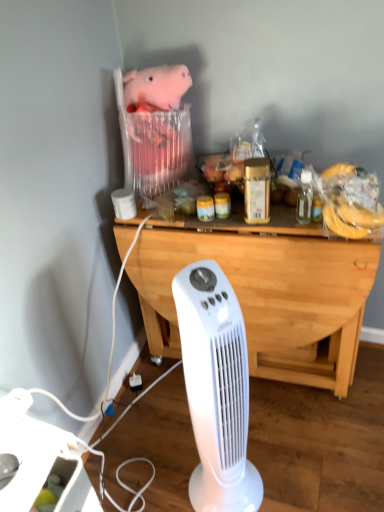
Measure the distance between point [60,469] and camera.

The depth of point [60,469] is 37.48 inches.

This screenshot has height=512, width=384. I want to click on white plastic fan at center, so click(216, 389).

This screenshot has width=384, height=512. In order to click on clear glass bottle at upper right in this screenshot , I will do `click(304, 198)`.

Measure the distance between clear glass bottle at upper right and camera.

clear glass bottle at upper right and camera are 4.18 feet apart.

Image resolution: width=384 pixels, height=512 pixels. Describe the element at coordinates (267, 297) in the screenshot. I see `light wood/dark brown desk at center` at that location.

Where is `white plastic power strip at lower left`? The width and height of the screenshot is (384, 512). white plastic power strip at lower left is located at coordinates 40,459.

Considering the positions of points (296, 218) and (225, 472), is point (296, 218) farther from camera compared to point (225, 472)?

Yes.

Is clear glass bottle at upper right completely or partially outside of white plastic fan at center?

Indeed, clear glass bottle at upper right is completely outside white plastic fan at center.

Can you tell me how much clear glass bottle at upper right and white plastic fan at center differ in facing direction?

The facing directions of clear glass bottle at upper right and white plastic fan at center are 34.7 degrees apart.

Considering the relative sizes of clear glass bottle at upper right and white plastic fan at center in the image provided, is clear glass bottle at upper right thinner than white plastic fan at center?

Yes, clear glass bottle at upper right is thinner than white plastic fan at center.

Visually, is white plastic power strip at lower left positioned to the left or to the right of clear glass bottle at upper right?

Based on their positions, white plastic power strip at lower left is located to the left of clear glass bottle at upper right.

Who is more distant, white plastic power strip at lower left or clear glass bottle at upper right?

clear glass bottle at upper right is further from the camera.

At what (x,y) coordinates should I click in order to perform the action: click on bottle above the white plastic power strip at lower left (from the image's perspective). Please return your answer as a coordinate pair (x, y). The image size is (384, 512). Looking at the image, I should click on (304, 198).

From a real-world perspective, which is physically above, white plastic power strip at lower left or clear glass bottle at upper right?

clear glass bottle at upper right is physically above.

From the picture: From the image's perspective, which one is positioned higher, white plastic fan at center or clear glass bottle at upper right?

clear glass bottle at upper right, from the image's perspective.

From a real-world perspective, relative to clear glass bottle at upper right, is white plastic fan at center vertically above or below?

In terms of real-world spatial position, white plastic fan at center is below clear glass bottle at upper right.

Is white plastic fan at center wider than clear glass bottle at upper right?

Yes, white plastic fan at center is wider than clear glass bottle at upper right.

Considering the relative positions of white plastic fan at center and clear glass bottle at upper right in the image provided, is white plastic fan at center to the left or to the right of clear glass bottle at upper right?

Based on their positions, white plastic fan at center is located to the left of clear glass bottle at upper right.

Where is `bottle above the light wood/dark brown desk at center (from the image's perspective)`? The height and width of the screenshot is (512, 384). bottle above the light wood/dark brown desk at center (from the image's perspective) is located at coordinates (304, 198).

Relative to light wood/dark brown desk at center, is clear glass bottle at upper right in front or behind?

Visually, clear glass bottle at upper right is located behind light wood/dark brown desk at center.

Which is correct: clear glass bottle at upper right is inside light wood/dark brown desk at center, or outside of it?

clear glass bottle at upper right is not inside light wood/dark brown desk at center, it's outside.

Is clear glass bottle at upper right placed right next to light wood/dark brown desk at center?

No, clear glass bottle at upper right is not making contact with light wood/dark brown desk at center.

Would you say white plastic fan at center is part of light wood/dark brown desk at center's contents?

No, white plastic fan at center is not a part of light wood/dark brown desk at center.

Is light wood/dark brown desk at center smaller than white plastic fan at center?

Incorrect, light wood/dark brown desk at center is not smaller in size than white plastic fan at center.

Measure the distance between light wood/dark brown desk at center and white plastic fan at center.

light wood/dark brown desk at center is 18.16 inches from white plastic fan at center.

From a real-world perspective, between light wood/dark brown desk at center and white plastic fan at center, who is vertically higher?

In real-world perspective, white plastic fan at center is above.

Can clear glass bottle at upper right be found inside light wood/dark brown desk at center?

That's incorrect, clear glass bottle at upper right is not inside light wood/dark brown desk at center.

Would you say light wood/dark brown desk at center is to the left or to the right of clear glass bottle at upper right in the picture?

In the image, light wood/dark brown desk at center appears on the left side of clear glass bottle at upper right.

Is the position of light wood/dark brown desk at center less distant than that of clear glass bottle at upper right?

Yes, the depth of light wood/dark brown desk at center is less than that of clear glass bottle at upper right.

Identify the location of bottle located behind the light wood/dark brown desk at center. This screenshot has height=512, width=384. (304, 198).

Where is `desk beneath the pink plush toy at upper center (from a real-world perspective)`? desk beneath the pink plush toy at upper center (from a real-world perspective) is located at coordinates (267, 297).

How many degrees apart are the facing directions of pink plush toy at upper center and light wood/dark brown desk at center?

pink plush toy at upper center and light wood/dark brown desk at center are facing 1.95 degrees away from each other.

In terms of size, does pink plush toy at upper center appear bigger or smaller than light wood/dark brown desk at center?

In the image, pink plush toy at upper center appears to be smaller than light wood/dark brown desk at center.

Is pink plush toy at upper center oriented towards light wood/dark brown desk at center?

No, pink plush toy at upper center is not aimed at light wood/dark brown desk at center.

Image resolution: width=384 pixels, height=512 pixels. Find the location of `bottle located above the white plastic fan at center (from the image's perspective)`. bottle located above the white plastic fan at center (from the image's perspective) is located at coordinates (304, 198).

At what (x,y) coordinates should I click in order to perform the action: click on bottle located above the white plastic power strip at lower left (from a real-world perspective). Please return your answer as a coordinate pair (x, y). This screenshot has height=512, width=384. Looking at the image, I should click on (304, 198).

Estimate the real-world distances between objects in this image. Which object is further from light wood/dark brown desk at center, white plastic fan at center or pink plush toy at upper center?

white plastic fan at center is further to light wood/dark brown desk at center.

Which object lies nearer to the anchor point clear glass bottle at upper right, white plastic power strip at lower left or light wood/dark brown desk at center?

light wood/dark brown desk at center is positioned closer to the anchor clear glass bottle at upper right.

Which object lies nearer to the anchor point pink plush toy at upper center, clear glass bottle at upper right or light wood/dark brown desk at center?

Among the two, light wood/dark brown desk at center is located nearer to pink plush toy at upper center.

When comparing their distances from clear glass bottle at upper right, does white plastic fan at center or white plastic power strip at lower left seem further?

Among the two, white plastic power strip at lower left is located further to clear glass bottle at upper right.

Estimate the real-world distances between objects in this image. Which object is further from white plastic power strip at lower left, clear glass bottle at upper right or pink plush toy at upper center?

clear glass bottle at upper right.

Estimate the real-world distances between objects in this image. Which object is closer to clear glass bottle at upper right, pink plush toy at upper center or light wood/dark brown desk at center?

Among the two, light wood/dark brown desk at center is located nearer to clear glass bottle at upper right.

From the image, which object appears to be nearer to white plastic power strip at lower left, white plastic fan at center or light wood/dark brown desk at center?

white plastic fan at center.

Which object lies nearer to the anchor point clear glass bottle at upper right, light wood/dark brown desk at center or pink plush toy at upper center?

light wood/dark brown desk at center is positioned closer to the anchor clear glass bottle at upper right.

Where is `home appliance between pink plush toy at upper center and white plastic power strip at lower left in the vertical direction`? The image size is (384, 512). home appliance between pink plush toy at upper center and white plastic power strip at lower left in the vertical direction is located at coordinates (216, 389).

The width and height of the screenshot is (384, 512). Find the location of `desk between pink plush toy at upper center and white plastic fan at center from top to bottom`. desk between pink plush toy at upper center and white plastic fan at center from top to bottom is located at coordinates (267, 297).

You are a GUI agent. You are given a task and a screenshot of the screen. Output one action in this format:
    pyautogui.click(x=<x>, y=<y>)
    Task: Click on the bottle between pink plush toy at upper center and white plastic power strip at lower left in the vertical direction
    
    Given the screenshot: What is the action you would take?
    [x=304, y=198]

The image size is (384, 512). I want to click on desk that lies between clear glass bottle at upper right and white plastic power strip at lower left from top to bottom, so click(267, 297).